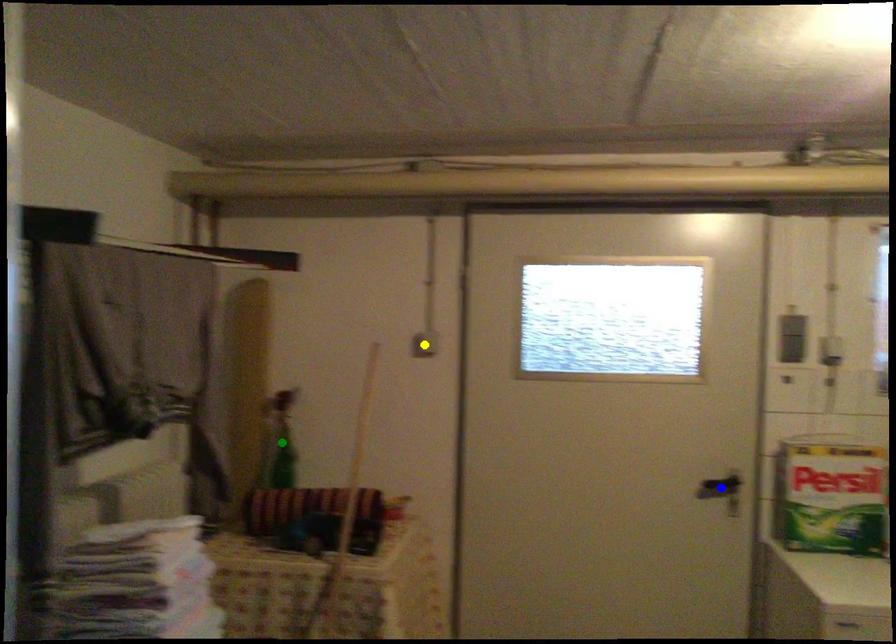
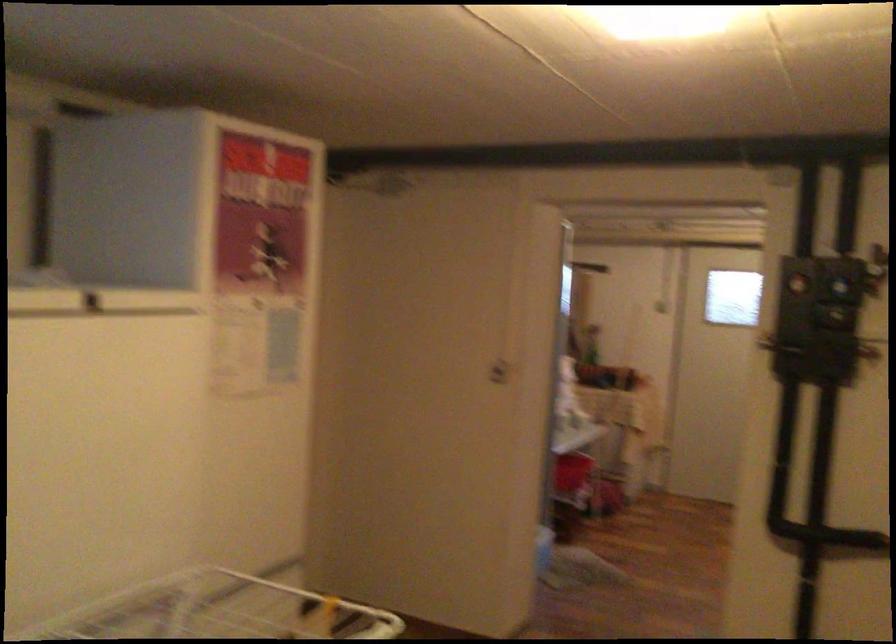
I am providing you with two images of the same scene from different viewpoints. Three points are marked in image1. Which point corresponds to a part or object that is occluded in image2?In image1, three points are marked. Which of them correspond to a part or object that is occluded in image2?Among the three points shown in image1, which one corresponds to a part or object that is no longer visible due to occlusion in image2?

Invisible in image2: blue point, green point, yellow point.